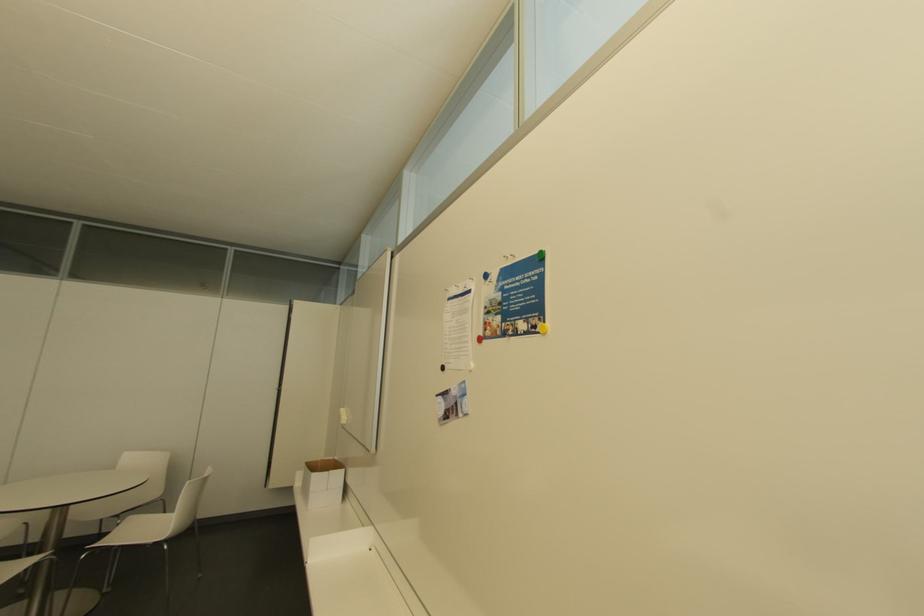
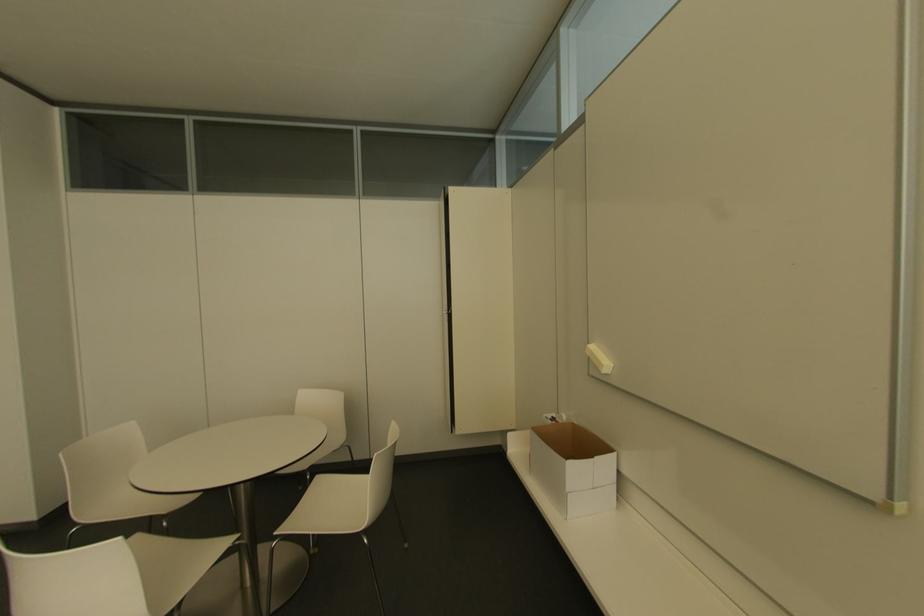
Which direction would the cameraman need to move to produce the second image?

The movement direction of the cameraman is left, forward.